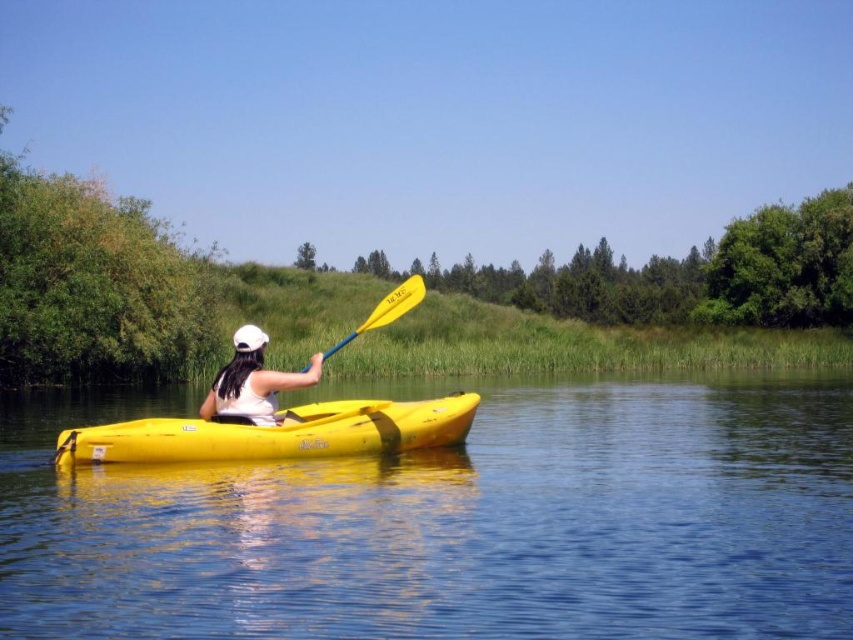
Who is positioned more to the right, yellow matte kayak at center or white matte kayak at center?

From the viewer's perspective, white matte kayak at center appears more on the right side.

Is yellow matte kayak at center bigger than white matte kayak at center?

No.

What do you see at coordinates (276, 433) in the screenshot?
I see `yellow matte kayak at center` at bounding box center [276, 433].

Locate an element on the screen. The image size is (853, 640). yellow matte kayak at center is located at coordinates (276, 433).

Which is below, yellow plastic kayak at center or white matte kayak at center?

yellow plastic kayak at center is lower down.

Which is more to the right, yellow plastic kayak at center or white matte kayak at center?

Positioned to the right is yellow plastic kayak at center.

The width and height of the screenshot is (853, 640). I want to click on yellow plastic kayak at center, so click(454, 522).

The image size is (853, 640). What are the coordinates of `yellow plastic kayak at center` in the screenshot? It's located at (454, 522).

Can you confirm if yellow plastic kayak at center is bigger than yellow matte kayak at center?

Yes.

Between point (244, 557) and point (190, 429), which one is positioned in front?

Point (244, 557) is more forward.

Where is `yellow plastic kayak at center`? The image size is (853, 640). yellow plastic kayak at center is located at coordinates (454, 522).